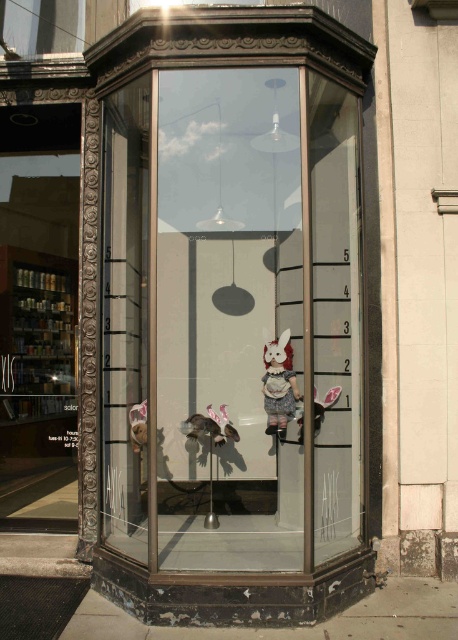
Question: Estimate the real-world distances between objects in this image. Which object is farther from the shiny silver bird at center?

Choices:
 (A) white plush rabbit at center
 (B) matte fabric doll at center
 (C) transparent glass door at center
 (D) clear glass window at upper left

Answer: (D)

Question: Which point is farther from the camera taking this photo?

Choices:
 (A) (339, 390)
 (B) (276, 356)

Answer: (B)

Question: Does clear glass shelves at left appear on the left side of white plush rabbit at center?

Choices:
 (A) no
 (B) yes

Answer: (B)

Question: Which of the following is the closest to the observer?

Choices:
 (A) shiny silver bird at center
 (B) clear glass shelves at left

Answer: (A)

Question: In this image, where is transparent glass door at center located relative to matte fabric doll at center?

Choices:
 (A) above
 (B) below

Answer: (A)

Question: Does clear glass shelves at left appear on the right side of clear glass window at upper left?

Choices:
 (A) no
 (B) yes

Answer: (A)